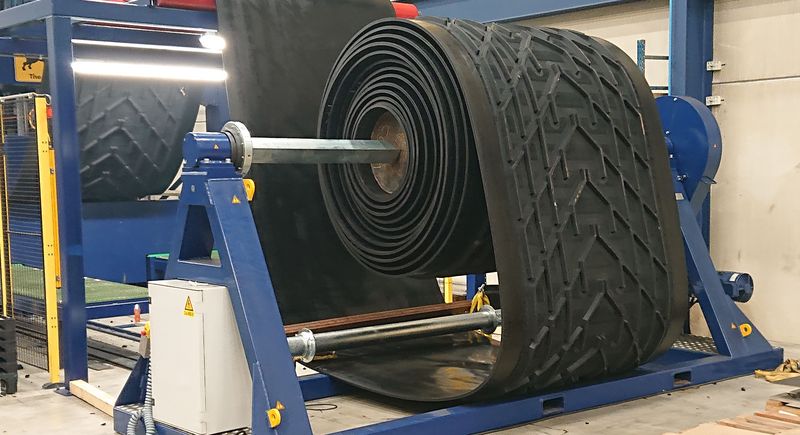
The image size is (800, 435). Identify the location of blue vertical support beam. [x=681, y=22].